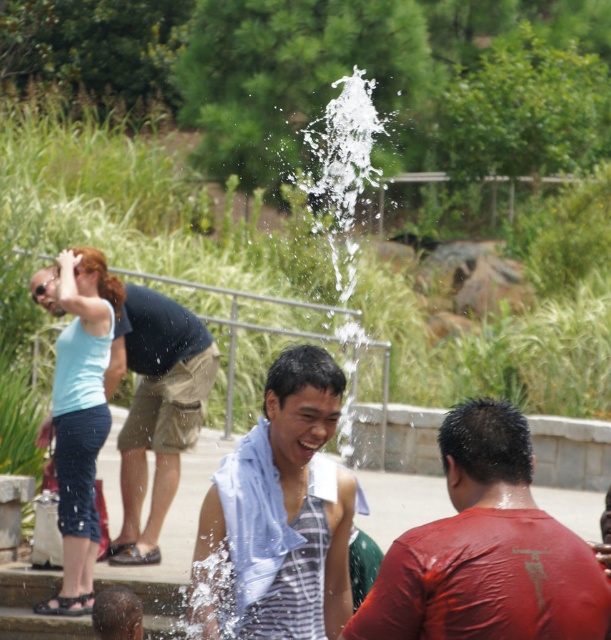
You are at the water fountain and want to find someone wearing a matte red shirt at center. According to the scene, where would you look relative to the person in matte black shirt at upper left?

The matte red shirt at center is located below the matte black shirt at upper left, so you should look downward from the matte black shirt at upper left to find the matte red shirt at center.